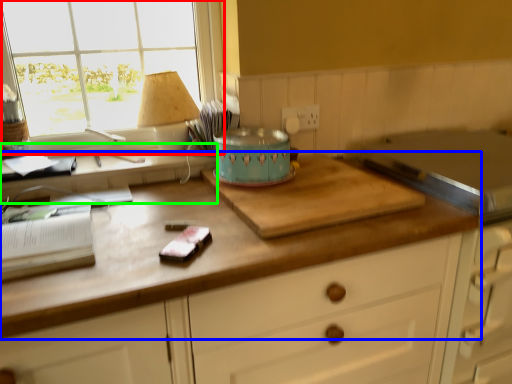
Question: Which object is the closest to the window (highlighted by a red box)? Choose among these: countertop (highlighted by a blue box) or computer desk (highlighted by a green box).

Choices:
 (A) countertop
 (B) computer desk

Answer: (B)